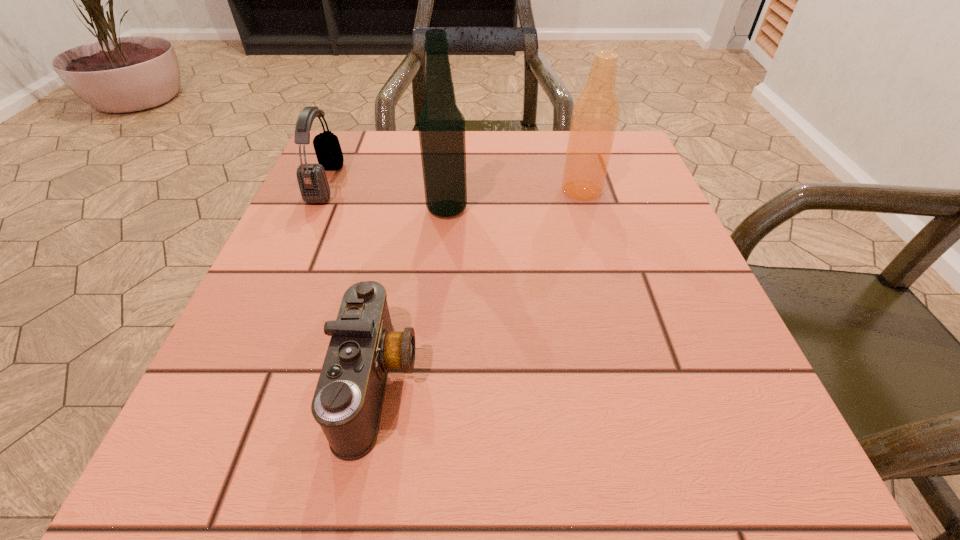
Image resolution: width=960 pixels, height=540 pixels. What are the coordinates of `alcohol` in the screenshot? It's located at (441, 125).

Image resolution: width=960 pixels, height=540 pixels. I want to click on the third shortest object, so click(x=595, y=115).

Identify the location of beer bottle. This screenshot has height=540, width=960. (595, 115).

This screenshot has width=960, height=540. I want to click on headset, so click(312, 180).

Image resolution: width=960 pixels, height=540 pixels. In order to click on the leftmost object in this screenshot , I will do `click(312, 180)`.

At what (x,y) coordinates should I click in order to perform the action: click on the nearest object. Please return your answer as a coordinate pair (x, y). Looking at the image, I should click on (347, 404).

Where is `the shortest object`? The image size is (960, 540). the shortest object is located at coordinates (347, 404).

Find the location of a particular element. The width and height of the screenshot is (960, 540). vacant space positioned on the back of the tallest object is located at coordinates [449, 183].

This screenshot has height=540, width=960. What are the coordinates of `vacant space situated 0.050m on the left of the beer bottle` in the screenshot? It's located at pos(537,190).

This screenshot has height=540, width=960. What are the coordinates of `free space located on the headband of the third tallest object` in the screenshot? It's located at (409, 183).